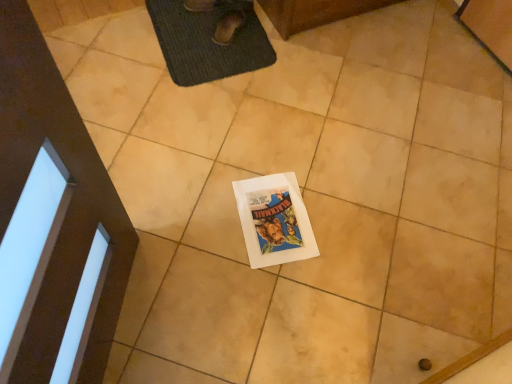
Question: Visually, is brown suede shoe at upper center positioned to the left or to the right of white paper comic book at center?

Choices:
 (A) right
 (B) left

Answer: (B)

Question: From the image's perspective, is brown suede shoe at upper center located above or below white paper comic book at center?

Choices:
 (A) below
 (B) above

Answer: (B)

Question: Estimate the real-world distances between objects in this image. Which object is farther from the white paper comic book at center?

Choices:
 (A) dark gray textured bath mat at upper center
 (B) brown suede shoe at upper center

Answer: (B)

Question: Estimate the real-world distances between objects in this image. Which object is closer to the white paper comic book at center?

Choices:
 (A) brown suede shoe at upper center
 (B) dark gray textured bath mat at upper center

Answer: (B)